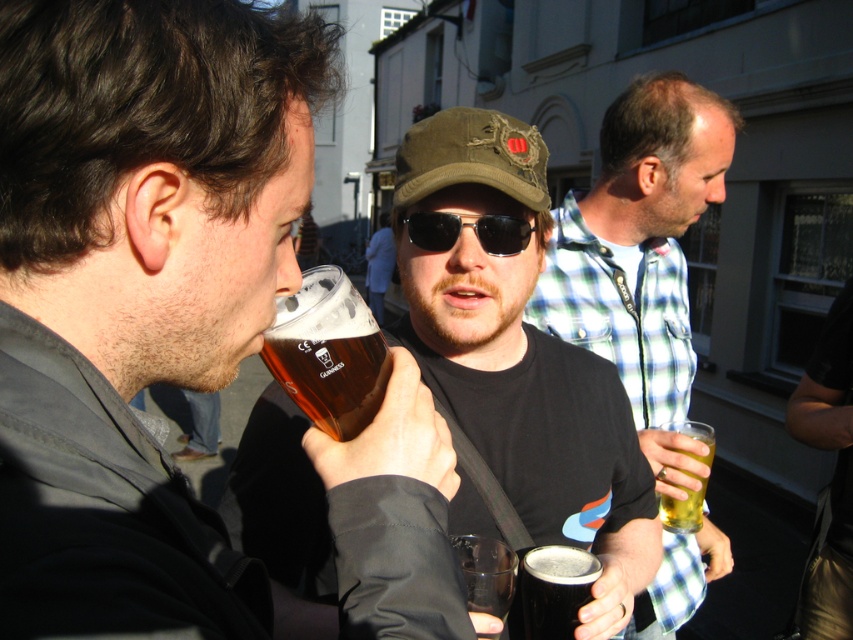
You are at an outdoor gathering and want to grab a drink. There are two cups in front of you. One is a translucent plastic cup at center and the other is a translucent glass beer at center. Which one is physically nearer to you?

The translucent plastic cup at center is closer to the viewer than the translucent glass beer at center, so the translucent plastic cup at center is physically nearer to you.